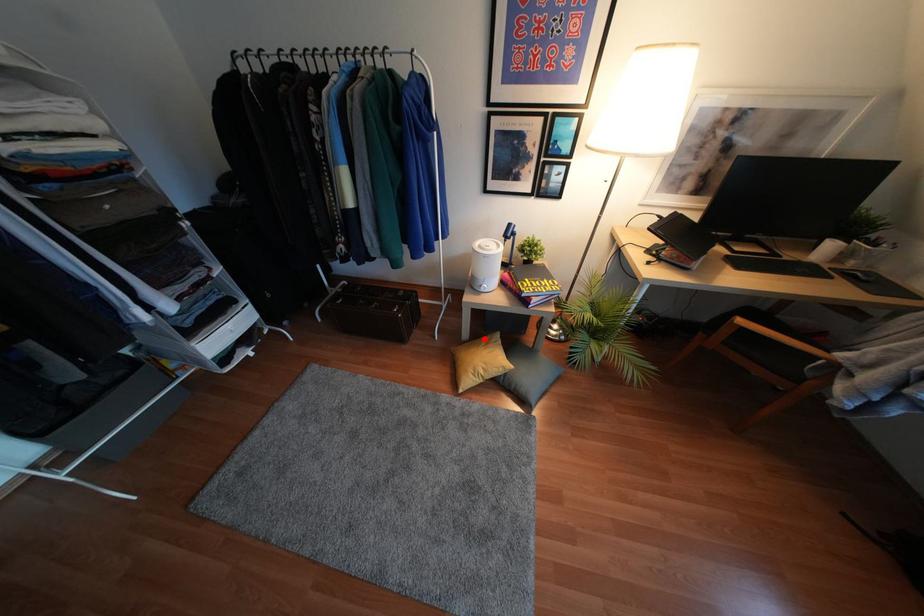
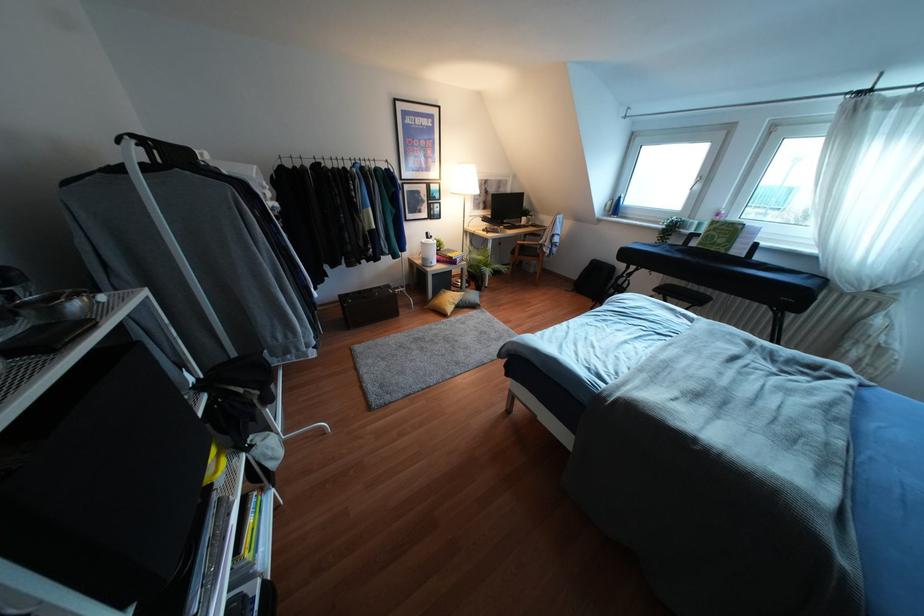
In the second image, find the point that corresponds to the highlighted location in the first image.

(441, 292)